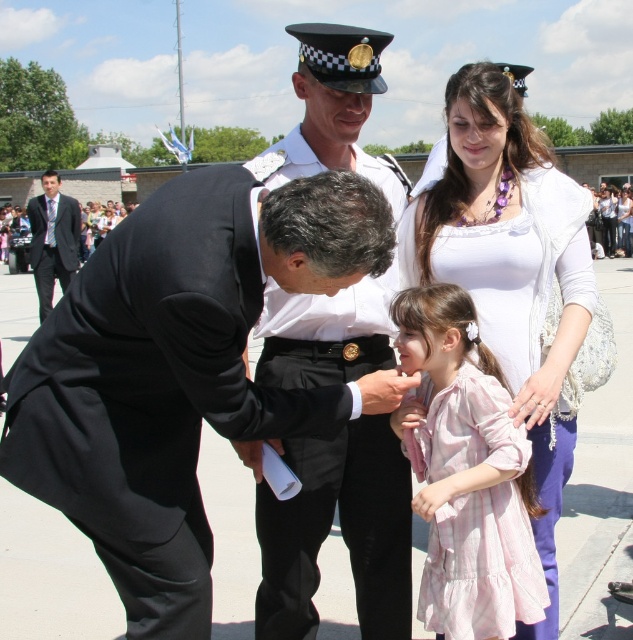
Is black matte suit at center positioned at the back of white cotton dress at center?

No, black matte suit at center is closer to the viewer.

Who is more distant from viewer, (334, 202) or (603, 196)?

The point (603, 196) is behind.

Locate an element on the screen. Image resolution: width=633 pixels, height=640 pixels. black matte suit at center is located at coordinates (182, 371).

This screenshot has width=633, height=640. I want to click on black matte suit at center, so click(x=182, y=371).

The height and width of the screenshot is (640, 633). In order to click on pink cotton dress at center in this screenshot , I will do `click(467, 474)`.

Between pink cotton dress at center and white cotton dress at center, which one has more height?

white cotton dress at center

The height and width of the screenshot is (640, 633). What are the coordinates of `pink cotton dress at center` in the screenshot? It's located at (467, 474).

Which is above, white textured sweater at upper right or white cotton dress at center?

white cotton dress at center

Is point (399, 248) closer to camera compared to point (587, 230)?

That is True.

Which is in front, point (517, 381) or point (618, 228)?

Point (517, 381) is more forward.

At what (x,y) coordinates should I click in order to perform the action: click on white textured sweater at upper right. Please return your answer as a coordinate pair (x, y). This screenshot has height=640, width=633. Looking at the image, I should click on (510, 269).